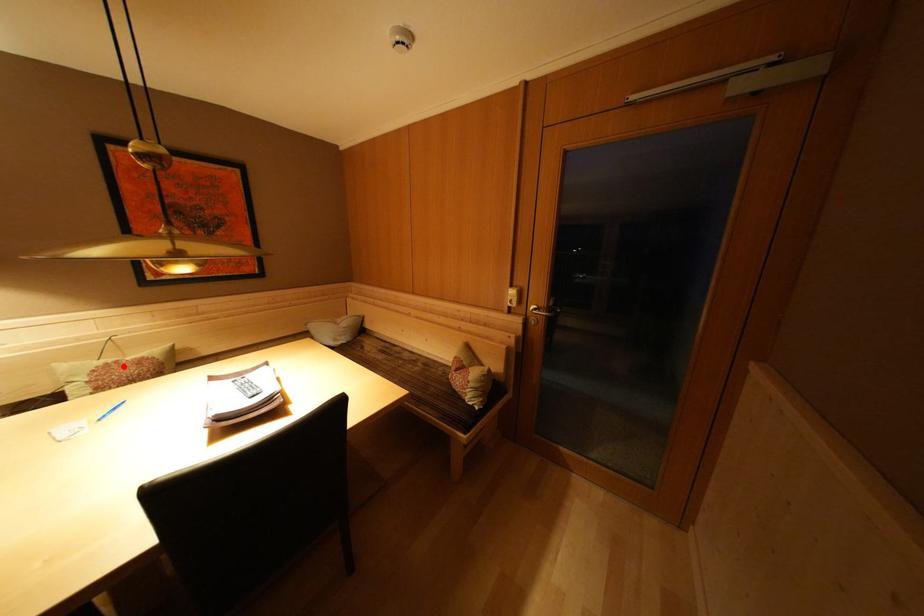
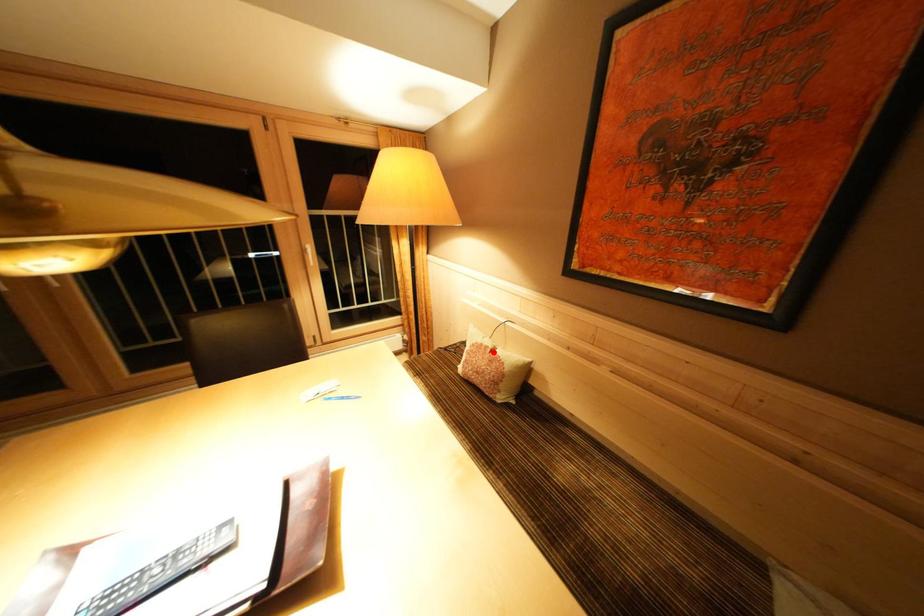
I am providing you with two images of the same scene from different viewpoints. A red point is marked on the first image and another point is marked on the second image. Is the marked point in image1 the same physical position as the marked point in image2?

Yes